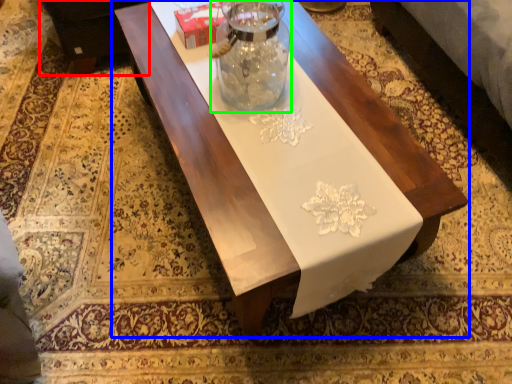
Question: Estimate the real-world distances between objects in this image. Which object is closer to couch (highlighted by a red box), table (highlighted by a blue box) or glass vase (highlighted by a green box)?

Choices:
 (A) table
 (B) glass vase

Answer: (A)